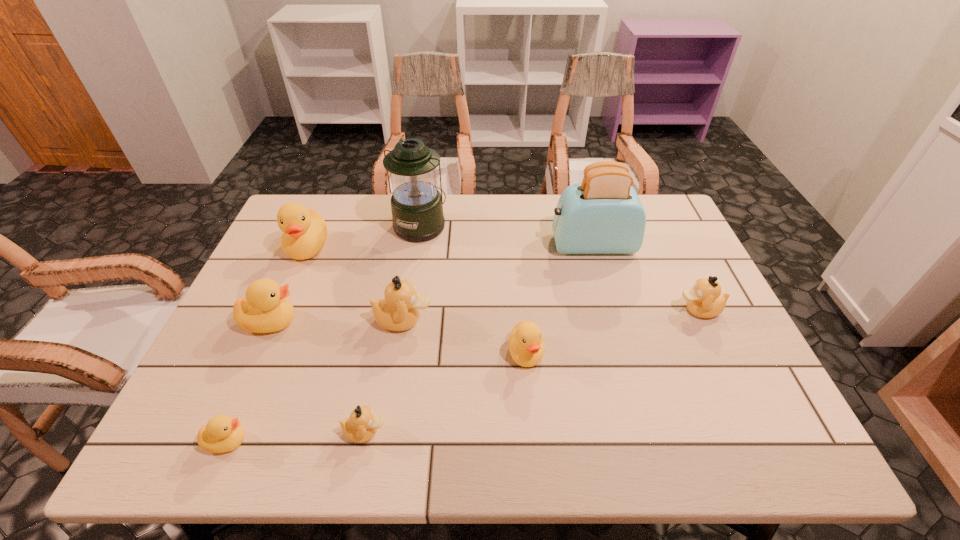
The image size is (960, 540). Find the location of `vacant area that lies between the third smallest yellow duckling and the green lantern`. vacant area that lies between the third smallest yellow duckling and the green lantern is located at coordinates (346, 274).

Locate an element on the screen. This screenshot has width=960, height=540. vacant area that lies between the light toaster and the smallest yellow duckling is located at coordinates (410, 343).

In order to click on free space between the biggest yellow duckling and the light toaster in this screenshot , I will do `click(449, 246)`.

The width and height of the screenshot is (960, 540). I want to click on free space between the second object from right to left and the rightmost duckling, so click(645, 278).

The image size is (960, 540). Find the location of `free space between the third smallest yellow duckling and the second biggest tan duckling`. free space between the third smallest yellow duckling and the second biggest tan duckling is located at coordinates (485, 316).

Find the location of a particular element. The image size is (960, 540). unoccupied position between the farthest duckling and the smallest tan duckling is located at coordinates (337, 340).

The width and height of the screenshot is (960, 540). What are the coordinates of `free point between the second biggest tan duckling and the smallest yellow duckling` in the screenshot? It's located at (463, 375).

Identify which object is the seventh nearest to the second biggest yellow duckling. Please provide its 2D coordinates. Your answer should be formatted as a tuple, i.e. [(x, y)], where the tuple contains the x and y coordinates of a point satisfying the conditions above.

[(602, 215)]

Find the location of a particular element. The image size is (960, 540). object that is the seventh closest one to the rightmost duckling is located at coordinates (304, 230).

Select which duckling appears as the sixth closest to the smallest tan duckling. Please provide its 2D coordinates. Your answer should be formatted as a tuple, i.e. [(x, y)], where the tuple contains the x and y coordinates of a point satisfying the conditions above.

[(704, 300)]